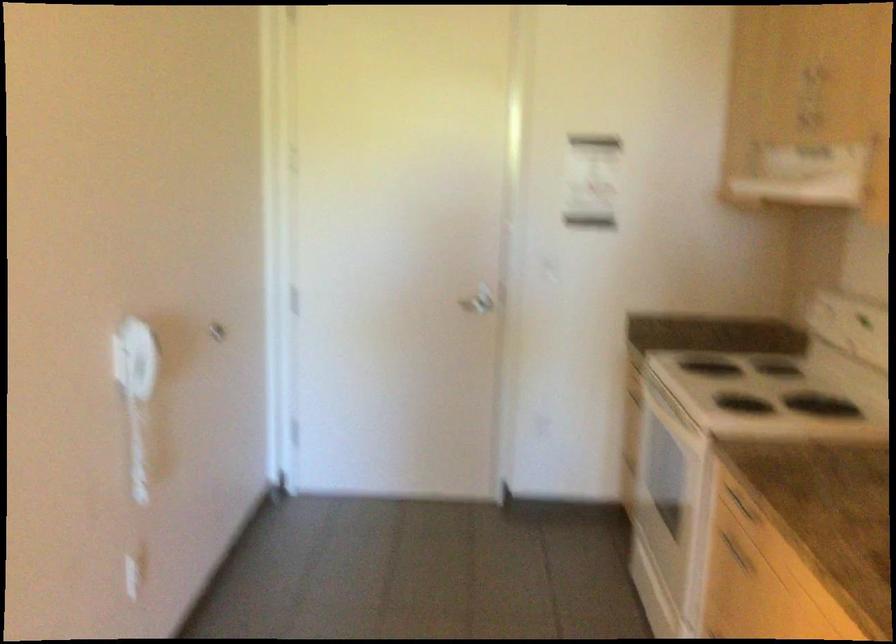
Where would you pull the silver door handle? Please return your answer as a coordinate pair (x, y).

(478, 301)